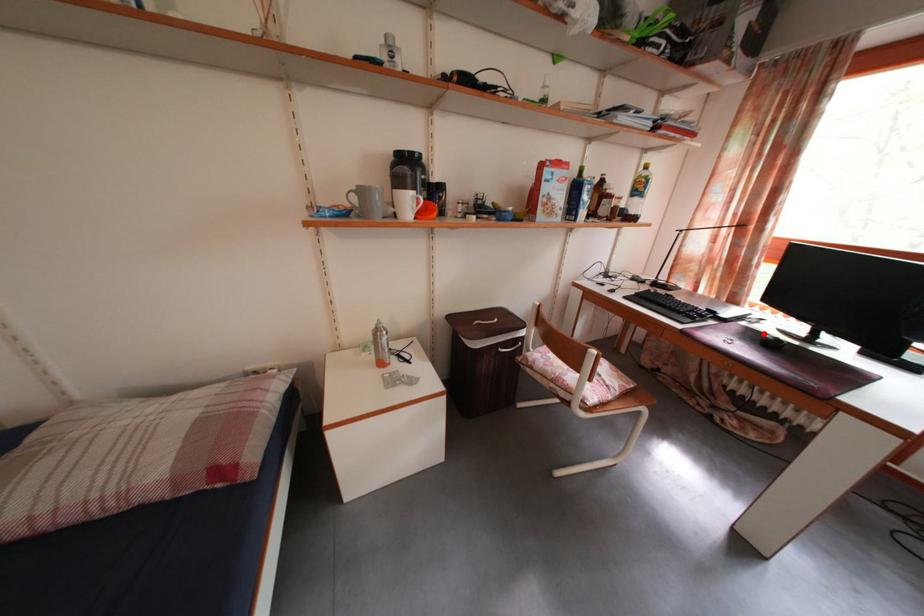
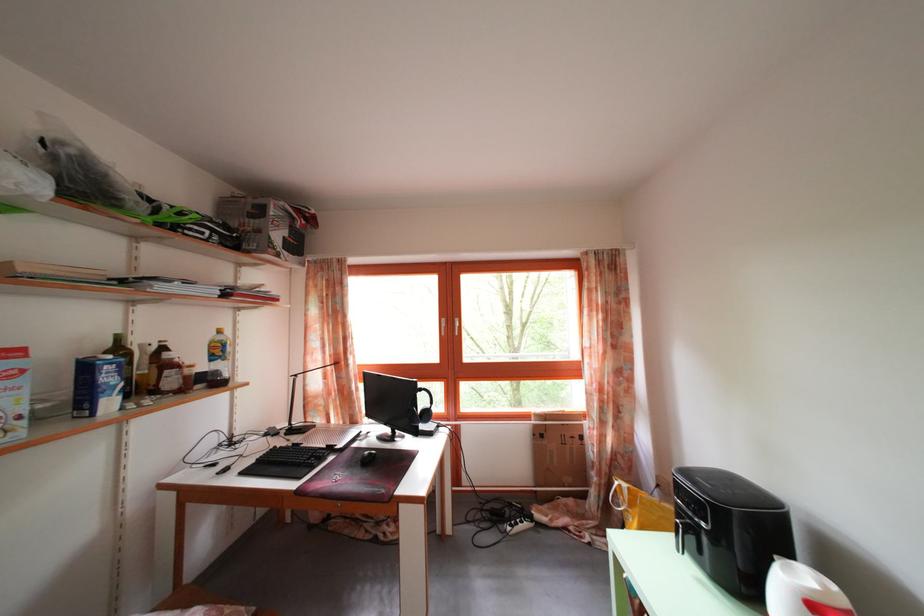
Question: I am providing you with two images of the same scene from different viewpoints. A red point is marked on the first image. Can you still see the location of the red point in image 2?

Choices:
 (A) Yes
 (B) No

Answer: (B)